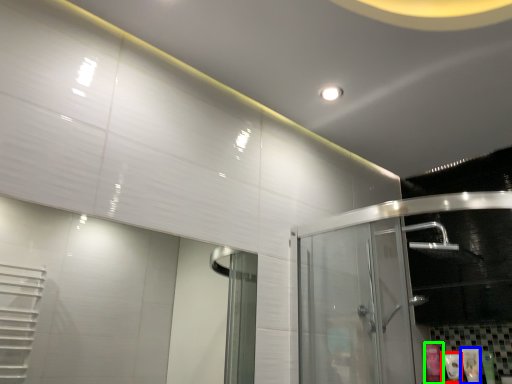
Question: Estimate the real-world distances between objects in this image. Which object is closer to toiletry (highlighted by a red box), toiletry (highlighted by a blue box) or toiletry (highlighted by a green box)?

Choices:
 (A) toiletry
 (B) toiletry

Answer: (B)